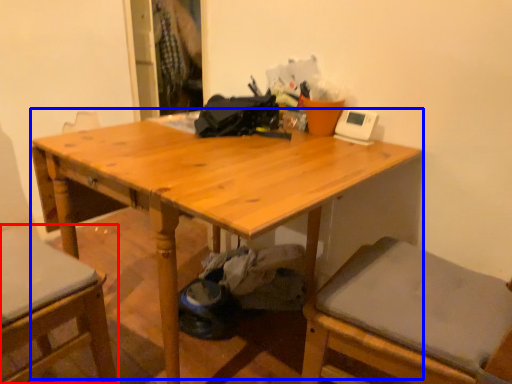
Question: Among these objects, which one is farthest to the camera, chair (highlighted by a red box) or table (highlighted by a blue box)?

Choices:
 (A) chair
 (B) table

Answer: (B)